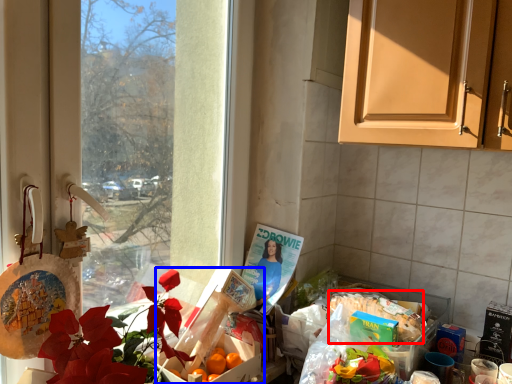
Question: Which point is further to the camera, food (highlighted by a red box) or box (highlighted by a blue box)?

Choices:
 (A) food
 (B) box

Answer: (A)